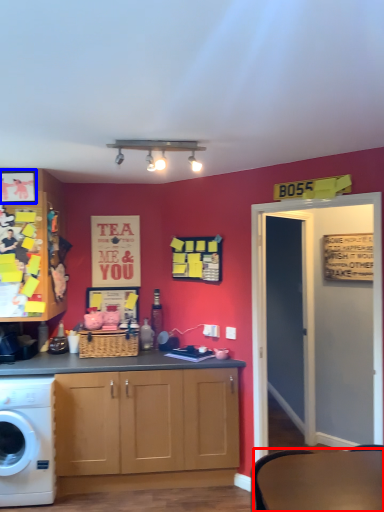
Question: Among these objects, which one is farthest to the camera, round table (highlighted by a red box) or picture frame (highlighted by a blue box)?

Choices:
 (A) round table
 (B) picture frame

Answer: (B)